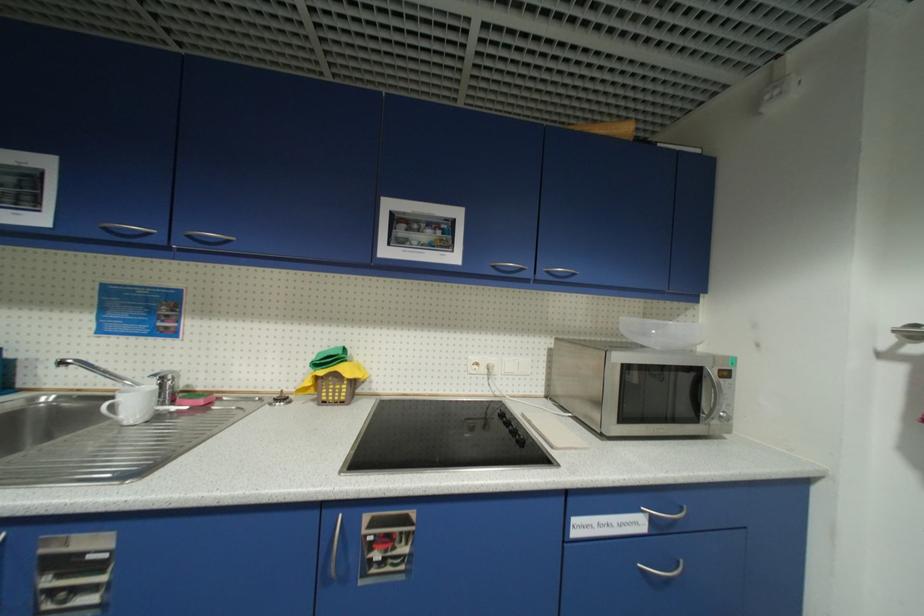
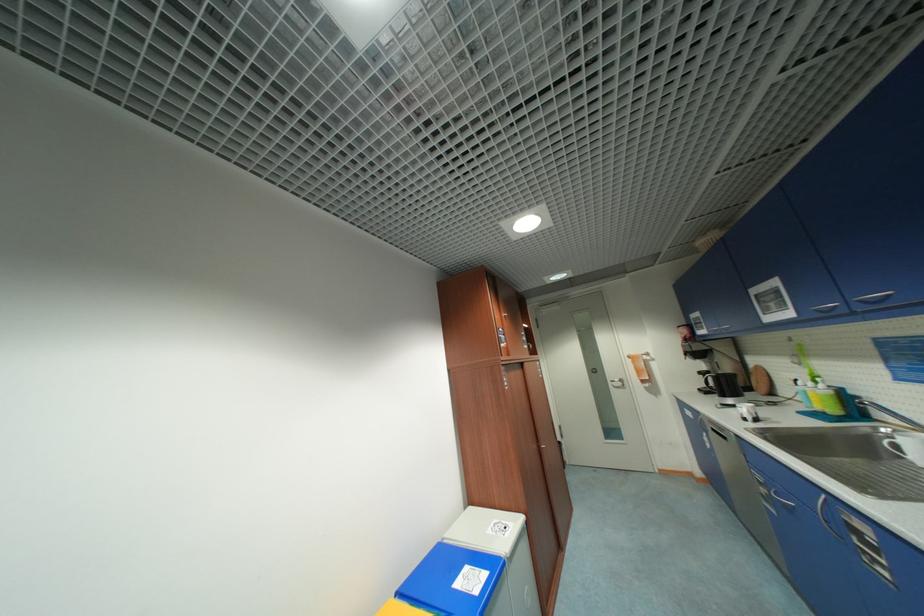
Where in the second image is the point corresponding to (196,238) from the first image?

(867, 302)